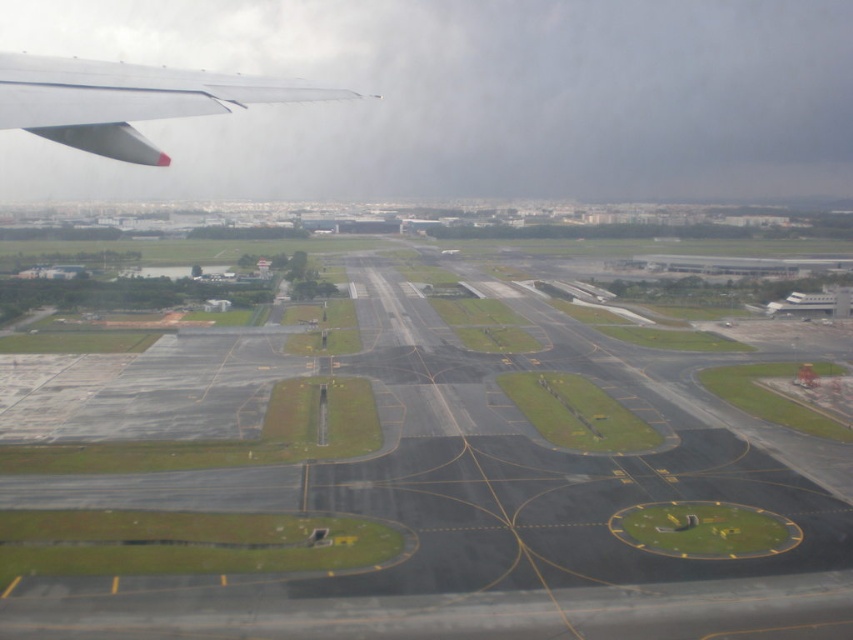
The height and width of the screenshot is (640, 853). What do you see at coordinates (440, 483) in the screenshot?
I see `black asphalt tarmac at center` at bounding box center [440, 483].

Who is shorter, black asphalt tarmac at center or matte white wing at upper left?

black asphalt tarmac at center

Which is behind, point (405, 458) or point (178, 115)?

Point (405, 458)

Image resolution: width=853 pixels, height=640 pixels. In order to click on black asphalt tarmac at center in this screenshot , I will do `click(440, 483)`.